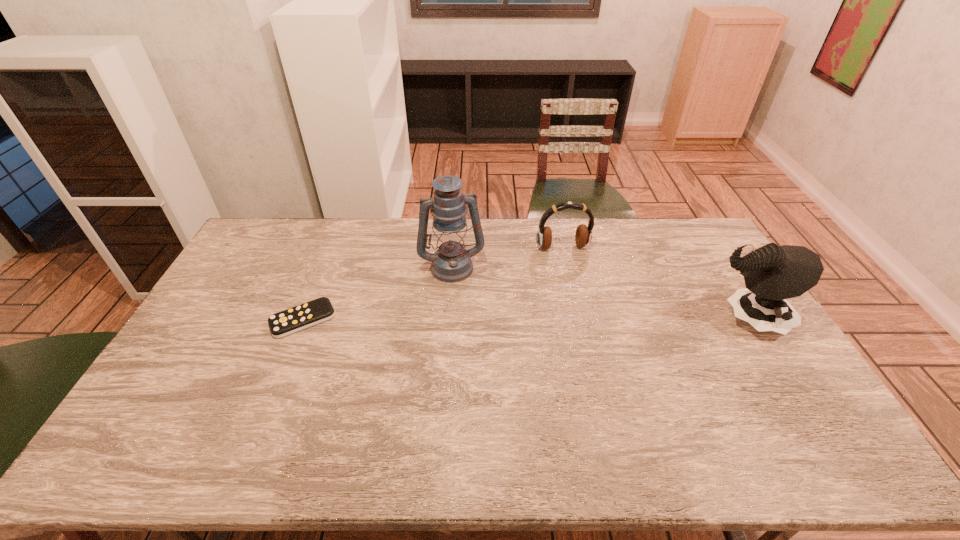
Find the location of a particular element. the shortest object is located at coordinates (281, 324).

Locate an element on the screen. This screenshot has width=960, height=540. the leftmost object is located at coordinates (281, 324).

This screenshot has width=960, height=540. Identify the location of the rightmost object. (772, 274).

In order to click on doll in this screenshot , I will do `click(772, 274)`.

Find the location of a particular element. headset is located at coordinates (583, 235).

Find the location of `the second object from right to left`. the second object from right to left is located at coordinates (583, 235).

I want to click on lantern, so click(x=451, y=262).

Identify the location of the tallest object. The height and width of the screenshot is (540, 960). (451, 262).

Where is `free space located on the front of the leftmost object`? free space located on the front of the leftmost object is located at coordinates click(286, 361).

Identify the location of vacant space located 0.180m on the ear cup of the third object from left to right. (579, 287).